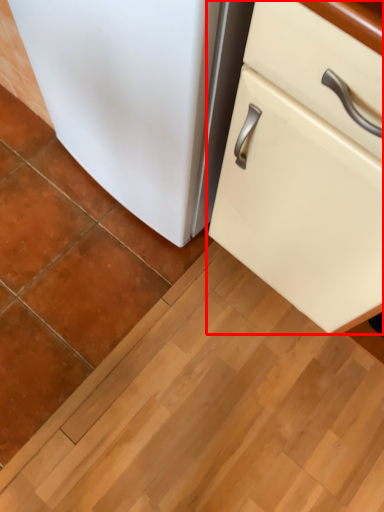
Question: Where is cabinetry (annotated by the red box) located in relation to refrigerator in the image?

Choices:
 (A) left
 (B) right

Answer: (B)